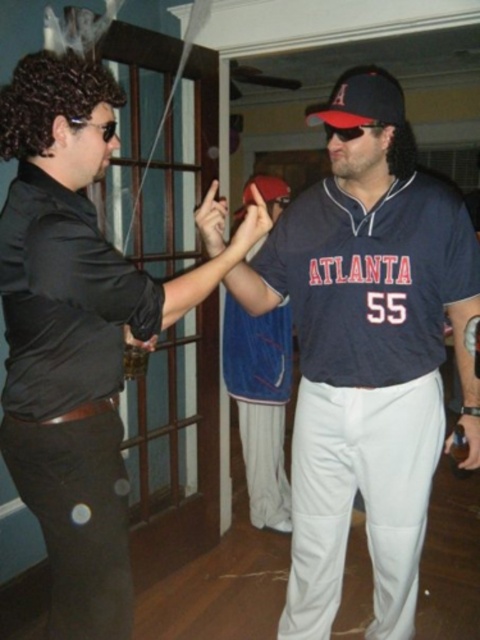
Where is `matte black baseball uniform at left`? The image size is (480, 640). matte black baseball uniform at left is located at coordinates (70, 394).

Who is more distant from viewer, (76, 508) or (112, 125)?

The point (76, 508) is more distant.

The width and height of the screenshot is (480, 640). Find the location of `matte black baseball uniform at left`. matte black baseball uniform at left is located at coordinates (70, 394).

Who is higher up, matte black baseball uniform at left or dark blue fabric baseball cap at center?

dark blue fabric baseball cap at center is above.

Can you confirm if matte black baseball uniform at left is taller than dark blue fabric baseball cap at center?

Yes.

The height and width of the screenshot is (640, 480). I want to click on matte black baseball uniform at left, so 70,394.

Is dark blue fabric baseball cap at center thinner than black plastic goggles at upper left?

No, dark blue fabric baseball cap at center is not thinner than black plastic goggles at upper left.

Does point (395, 124) come farther from viewer compared to point (72, 120)?

Yes, it is.

Find the location of a particular element. dark blue fabric baseball cap at center is located at coordinates (360, 100).

What are the coordinates of `dark blue fabric baseball cap at center` in the screenshot? It's located at (360, 100).